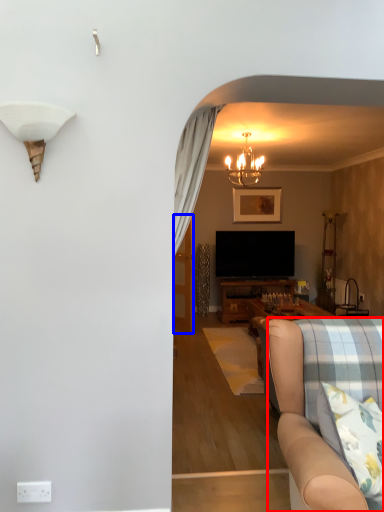
Question: Which point is further to the camera, studio couch (highlighted by a red box) or glass door (highlighted by a blue box)?

Choices:
 (A) studio couch
 (B) glass door

Answer: (B)